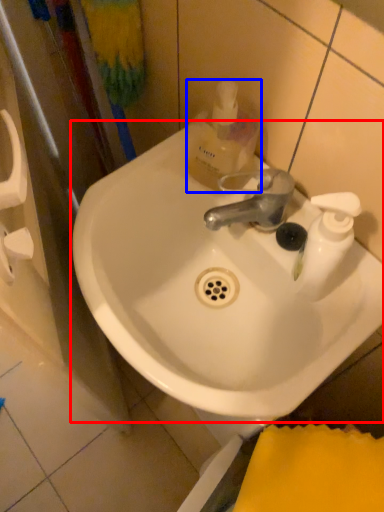
Question: Which object is further to the camera taking this photo, sink (highlighted by a red box) or mouthwash (highlighted by a blue box)?

Choices:
 (A) sink
 (B) mouthwash

Answer: (B)